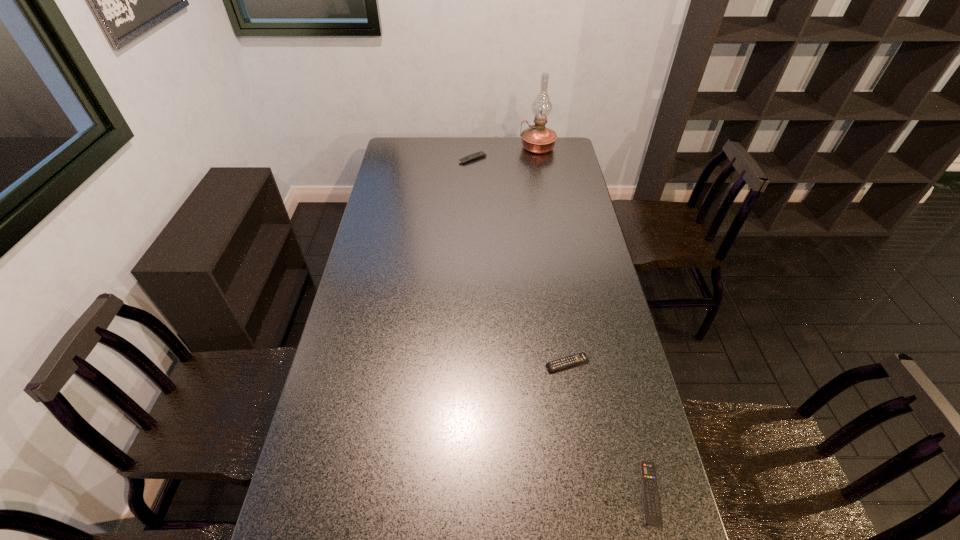
Locate an element on the screen. Image resolution: width=960 pixels, height=540 pixels. free space located 0.160m on the back of the nearest object is located at coordinates (629, 406).

This screenshot has width=960, height=540. I want to click on oil lamp present at the far edge, so click(538, 139).

At what (x,y) coordinates should I click in order to perform the action: click on remote control that is at the far edge. Please return your answer as a coordinate pair (x, y). The image size is (960, 540). Looking at the image, I should click on (480, 154).

At what (x,y) coordinates should I click in order to perform the action: click on oil lamp located at the right edge. Please return your answer as a coordinate pair (x, y). The image size is (960, 540). Looking at the image, I should click on (538, 139).

Identify the location of object positioned at the far right corner. (538, 139).

This screenshot has width=960, height=540. I want to click on free space at the far edge, so click(474, 144).

I want to click on vacant space at the left edge of the desktop, so click(x=408, y=163).

Image resolution: width=960 pixels, height=540 pixels. Find the location of `free space at the right edge`. free space at the right edge is located at coordinates (555, 177).

Locate an element on the screen. blank region between the farthest remote control and the tallest object is located at coordinates (505, 153).

Identify the location of empty location between the tallest object and the rightmost remote control. The image size is (960, 540). (594, 321).